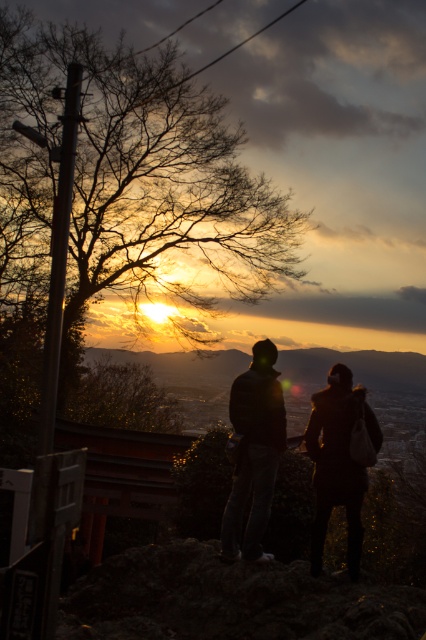
Can you confirm if dark brown leather jacket at center is positioned above dark blue jeans at center?

No.

How distant is dark brown leather jacket at center from dark blue jeans at center?

The distance of dark brown leather jacket at center from dark blue jeans at center is 5.52 inches.

You are a GUI agent. You are given a task and a screenshot of the screen. Output one action in this format:
    pyautogui.click(x=<x>, y=<y>)
    Task: Click on the dark brown leather jacket at center
    This screenshot has width=426, height=640.
    Given the screenshot: What is the action you would take?
    pyautogui.click(x=253, y=452)

The width and height of the screenshot is (426, 640). In order to click on dark brown leather jacket at center in this screenshot , I will do `click(253, 452)`.